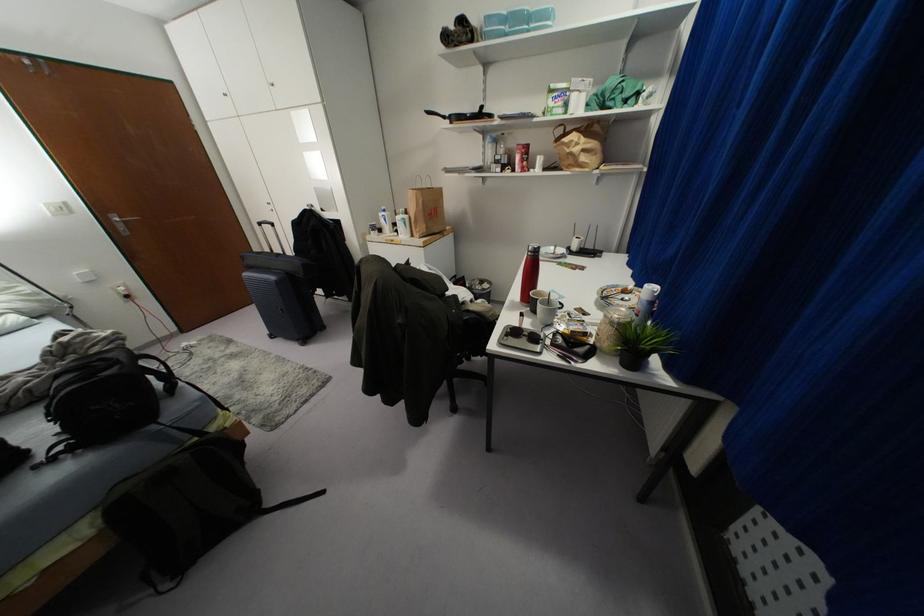
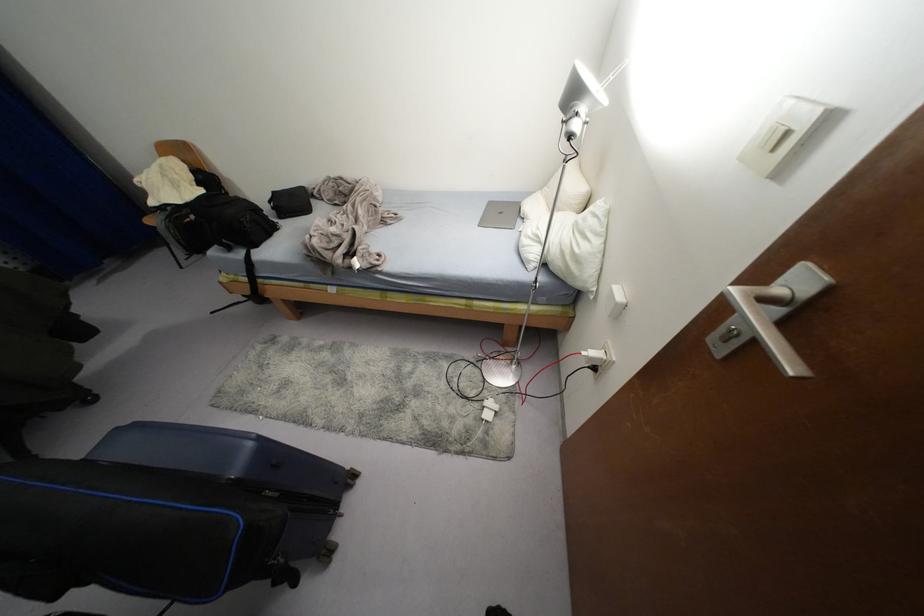
Find the pixel in the second image that matches pixel 122 288 in the first image.

(592, 353)